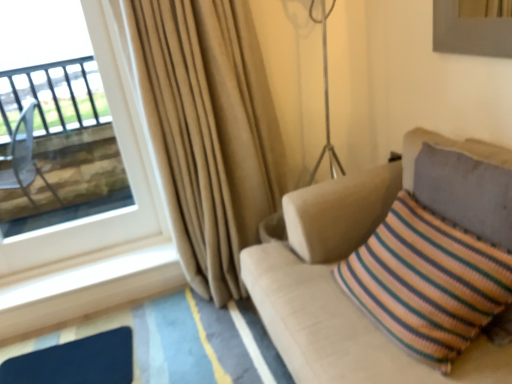
You are a GUI agent. You are given a task and a screenshot of the screen. Output one action in this format:
    pyautogui.click(x=<x>, y=<y>)
    Task: Click on the free location above matte blue mat at lower left (from a real-world perspective)
    
    Given the screenshot: What is the action you would take?
    coord(77,370)